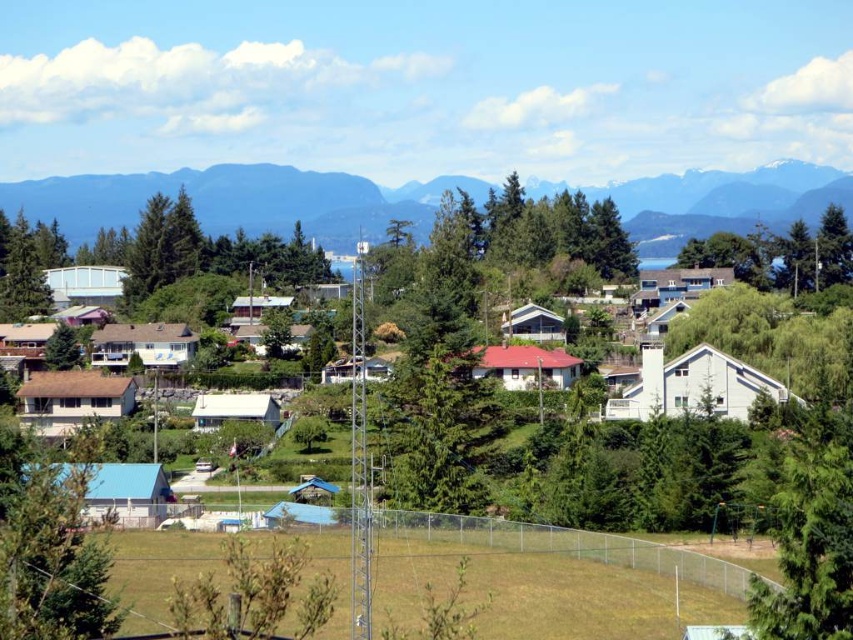
You are standing in the suburban landscape and want to take a photo of the green forested mountain at upper center without the green leafy tree at lower left blocking the view. Is the mountain visible behind the tree?

The green forested mountain at upper center is further to the viewer than the green leafy tree at lower left, so the tree is closer and would block the mountain from view. To capture the mountain without obstruction, you need to move to a position where the tree is not between you and the mountain.